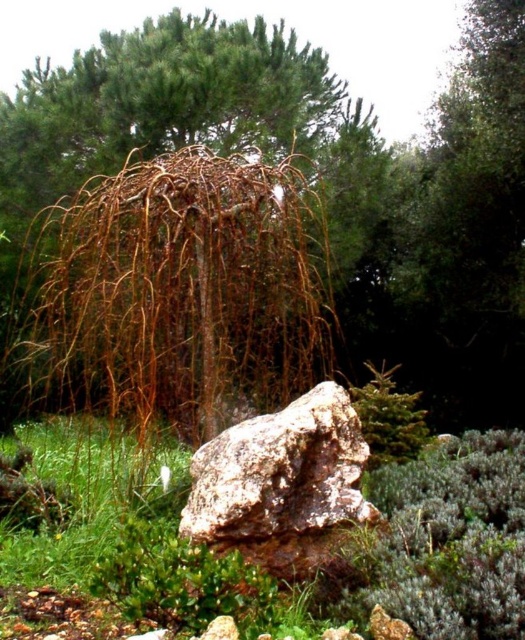
Question: In this image, where is brown/dried wood at center located relative to green grass at lower left?

Choices:
 (A) above
 (B) below

Answer: (A)

Question: Which object is closer to the camera taking this photo?

Choices:
 (A) rusty stone boulder at center
 (B) green grass at lower left
 (C) brown/dried wood at center

Answer: (A)

Question: Does brown/dried wood at center appear over green grass at lower left?

Choices:
 (A) no
 (B) yes

Answer: (B)

Question: Considering the real-world distances, which object is closest to the green grass at lower left?

Choices:
 (A) rusty stone boulder at center
 (B) brown/dried wood at center

Answer: (A)

Question: Among these points, which one is farthest from the camera?

Choices:
 (A) (52, 465)
 (B) (224, 518)
 (C) (237, 38)

Answer: (C)

Question: In this image, where is brown/dried wood at center located relative to green grass at lower left?

Choices:
 (A) above
 (B) below

Answer: (A)